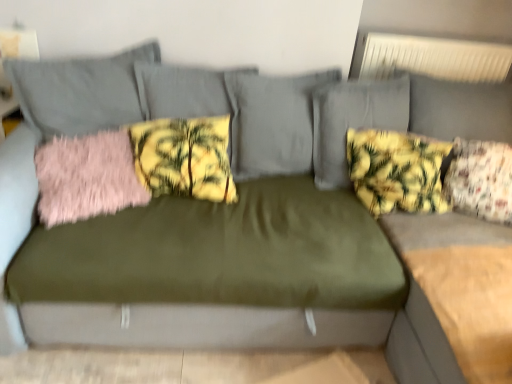
Question: Does yellow floral fabric pillow at center, which is the 3th pillow in right-to-left order, have a smaller size compared to pink fluffy pillow at left, which is counted as the 1th pillow, starting from the left?

Choices:
 (A) no
 (B) yes

Answer: (A)

Question: Could you tell me if yellow floral fabric pillow at center, which is the 3th pillow in right-to-left order, is facing pink fluffy pillow at left, the fourth pillow viewed from the right?

Choices:
 (A) yes
 (B) no

Answer: (B)

Question: Is yellow floral fabric pillow at center, which is the 3th pillow in right-to-left order, wider than pink fluffy pillow at left, which is counted as the 1th pillow, starting from the left?

Choices:
 (A) no
 (B) yes

Answer: (A)

Question: Does yellow floral fabric pillow at center, which appears as the second pillow when viewed from the left, have a greater height compared to pink fluffy pillow at left, the fourth pillow viewed from the right?

Choices:
 (A) yes
 (B) no

Answer: (A)

Question: From the image's perspective, does yellow floral fabric pillow at center, which is the 3th pillow in right-to-left order, appear higher than pink fluffy pillow at left, the fourth pillow viewed from the right?

Choices:
 (A) no
 (B) yes

Answer: (B)

Question: Does yellow floral fabric pillow at center, which is the 3th pillow in right-to-left order, appear on the right side of pink fluffy pillow at left, the fourth pillow viewed from the right?

Choices:
 (A) no
 (B) yes

Answer: (B)

Question: Does yellow floral fabric pillow at center, which is the 3th pillow in right-to-left order, have a smaller size compared to yellow floral fabric pillow at upper right, which is the 3th pillow in left-to-right order?

Choices:
 (A) yes
 (B) no

Answer: (A)

Question: Is yellow floral fabric pillow at center, which is the 3th pillow in right-to-left order, shorter than yellow floral fabric pillow at upper right, which is the 3th pillow in left-to-right order?

Choices:
 (A) no
 (B) yes

Answer: (B)

Question: Does yellow floral fabric pillow at center, which appears as the second pillow when viewed from the left, have a greater width compared to yellow floral fabric pillow at upper right, which is the 3th pillow in left-to-right order?

Choices:
 (A) no
 (B) yes

Answer: (B)

Question: Considering the relative sizes of yellow floral fabric pillow at center, which is the 3th pillow in right-to-left order, and yellow floral fabric pillow at upper right, which is the 3th pillow in left-to-right order, in the image provided, is yellow floral fabric pillow at center, which is the 3th pillow in right-to-left order, taller than yellow floral fabric pillow at upper right, which is the 3th pillow in left-to-right order,?

Choices:
 (A) yes
 (B) no

Answer: (B)

Question: Could you tell me if yellow floral fabric pillow at center, which is the 3th pillow in right-to-left order, is turned towards yellow floral fabric pillow at upper right, which is the 3th pillow in left-to-right order?

Choices:
 (A) yes
 (B) no

Answer: (B)

Question: Is yellow floral fabric pillow at center, which appears as the second pillow when viewed from the left, not close to yellow floral fabric pillow at upper right, which is the 3th pillow in left-to-right order?

Choices:
 (A) yes
 (B) no

Answer: (B)

Question: Would you say floral fabric pillow at right, which ranks as the first pillow in right-to-left order, is outside yellow floral fabric pillow at upper right, which is the 3th pillow in left-to-right order?

Choices:
 (A) yes
 (B) no

Answer: (A)